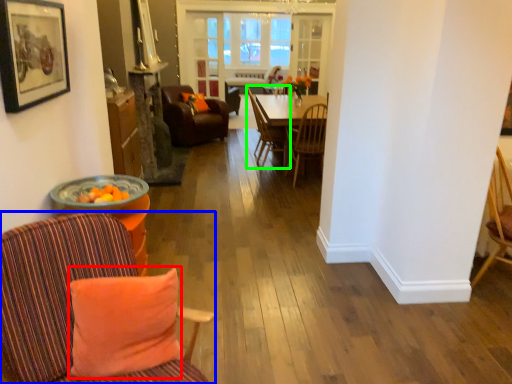
Question: Considering the real-world distances, which object is farthest from pillow (highlighted by a red box)? chair (highlighted by a blue box) or chair (highlighted by a green box)?

Choices:
 (A) chair
 (B) chair

Answer: (B)